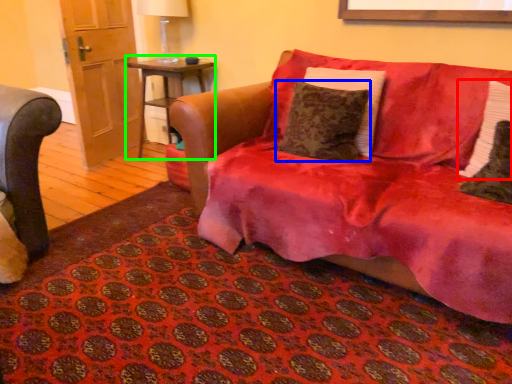
Question: Which object is the closest to the pillow (highlighted by a red box)? Choose among these: pillow (highlighted by a blue box) or table (highlighted by a green box).

Choices:
 (A) pillow
 (B) table

Answer: (A)